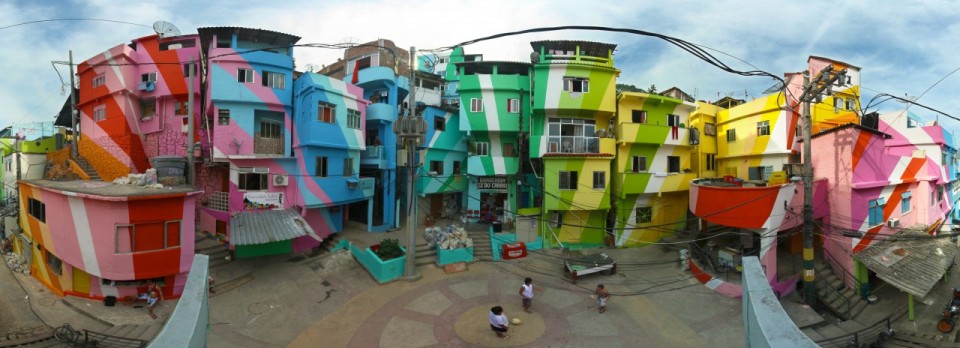
Where is `homes`? The image size is (960, 348). homes is located at coordinates 160,96.